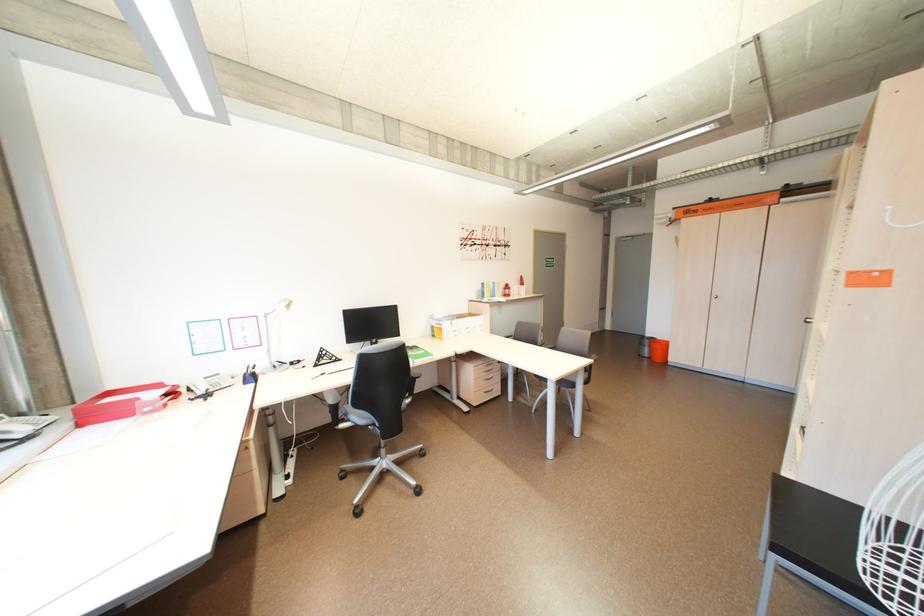
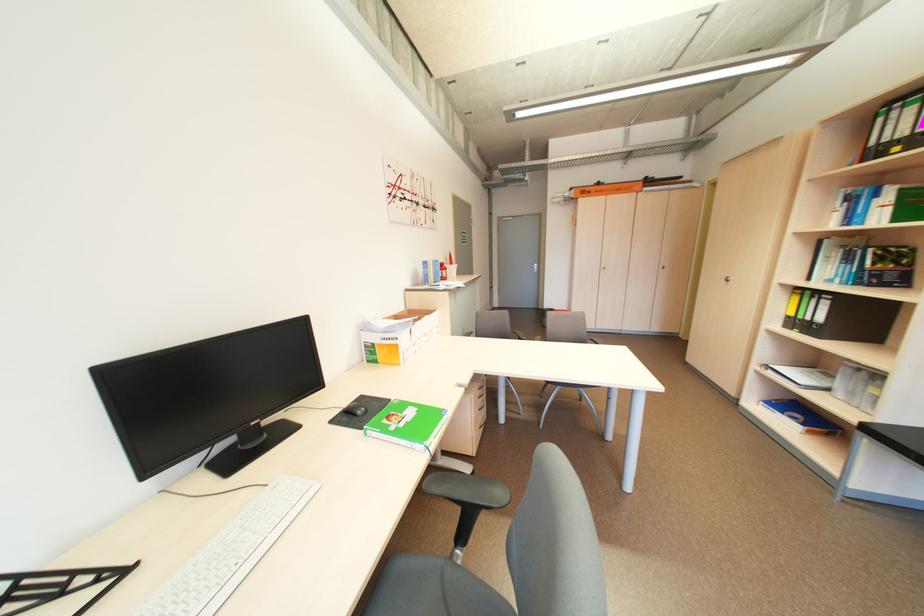
Where in the second image is the point corresponding to (706,213) from the first image?

(599, 193)